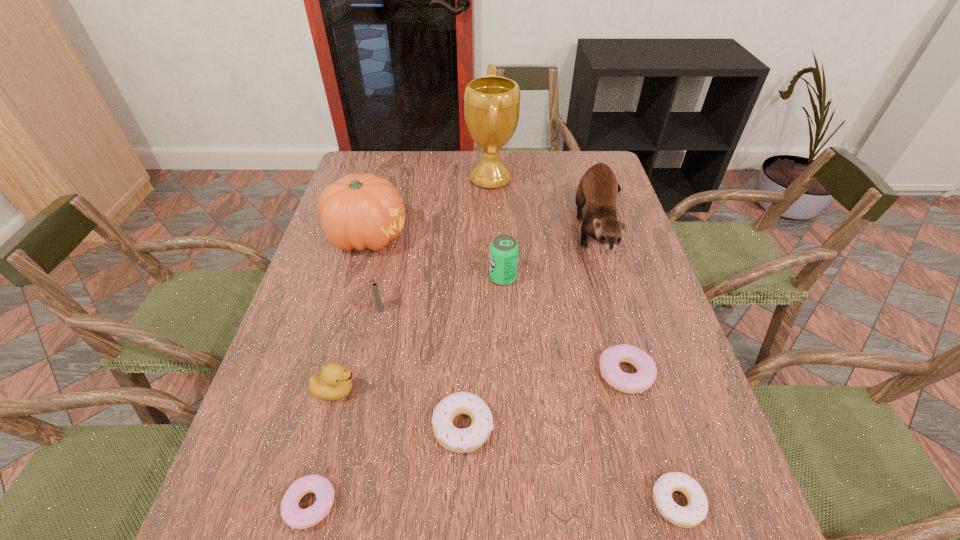
I want to click on the smaller white doughnut, so 694,513.

Where is `the nearer white doughnut`? the nearer white doughnut is located at coordinates [x=694, y=513].

This screenshot has width=960, height=540. Identify the location of the nearer pink doughnut. (297, 518).

You are a GUI agent. You are given a task and a screenshot of the screen. Output one action in this format:
    pyautogui.click(x=<x>, y=<y>)
    Task: Click on the leftmost doughnut
    
    Given the screenshot: What is the action you would take?
    pyautogui.click(x=297, y=518)

Identify the location of vacant area located on the front of the tallest object with the decoration. (387, 179).

Locate an element on the screen. vacant region located on the front of the tallest object with the decoration is located at coordinates (378, 179).

Find the location of a particular element. The width and height of the screenshot is (960, 540). vacant space located on the front of the tallest object with the decoration is located at coordinates (372, 179).

This screenshot has height=540, width=960. Find the location of `free space located 0.260m on the carved face of the pumpkin`. free space located 0.260m on the carved face of the pumpkin is located at coordinates (497, 237).

The image size is (960, 540). Find the location of `vacant space situated 0.380m at the face of the ferret`. vacant space situated 0.380m at the face of the ferret is located at coordinates (664, 422).

This screenshot has width=960, height=540. What are the coordinates of `blank space located 0.400m on the front-facing side of the pop soda` in the screenshot? It's located at (340, 278).